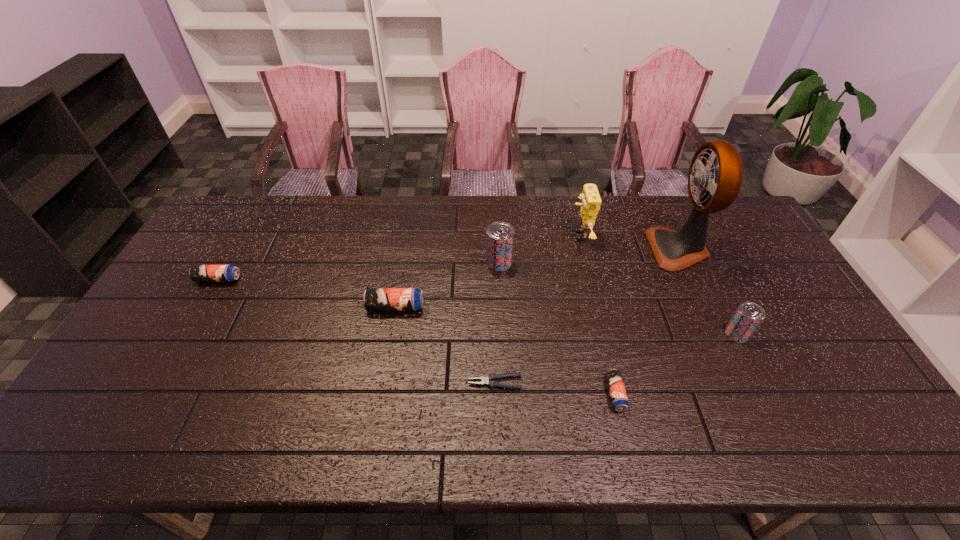
Where is `sponge situated at the far edge`? The height and width of the screenshot is (540, 960). sponge situated at the far edge is located at coordinates (591, 201).

The image size is (960, 540). What are the coordinates of `object positioned at the left edge` in the screenshot? It's located at (198, 273).

The height and width of the screenshot is (540, 960). I want to click on vacant position at the far edge of the desktop, so [488, 210].

I want to click on free space at the near edge of the desktop, so click(262, 453).

The height and width of the screenshot is (540, 960). Find the location of `vacant region at the left edge`. vacant region at the left edge is located at coordinates (180, 309).

This screenshot has height=540, width=960. In order to click on free space at the right edge in this screenshot , I will do `click(768, 252)`.

This screenshot has width=960, height=540. I want to click on vacant space at the far left corner of the desktop, so click(224, 215).

This screenshot has height=540, width=960. I want to click on free area in between the shortest beer can and the fourth beer can from right to left, so click(x=505, y=350).

Locate an element on the screen. free space between the sponge and the farthest beer can is located at coordinates (540, 249).

Where is `free space between the left red beer can and the seventh shortest object`? This screenshot has height=540, width=960. free space between the left red beer can and the seventh shortest object is located at coordinates (540, 249).